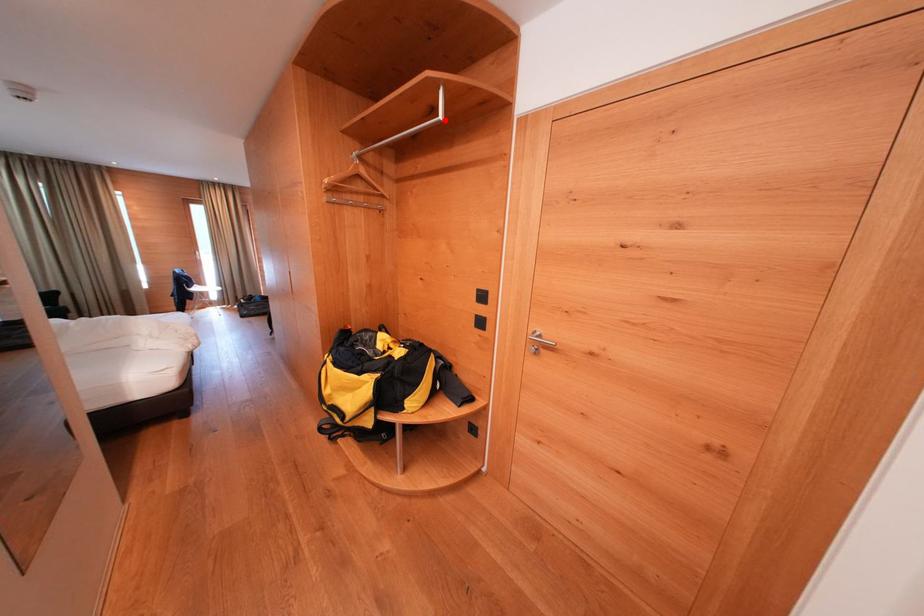
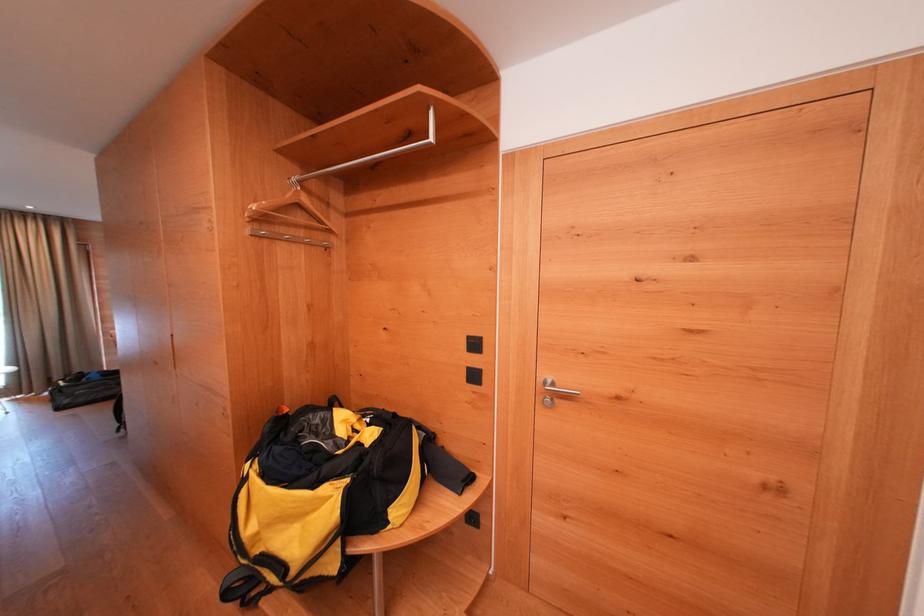
Find the pixel in the second image that matches the highlighted location in the first image.

(434, 142)